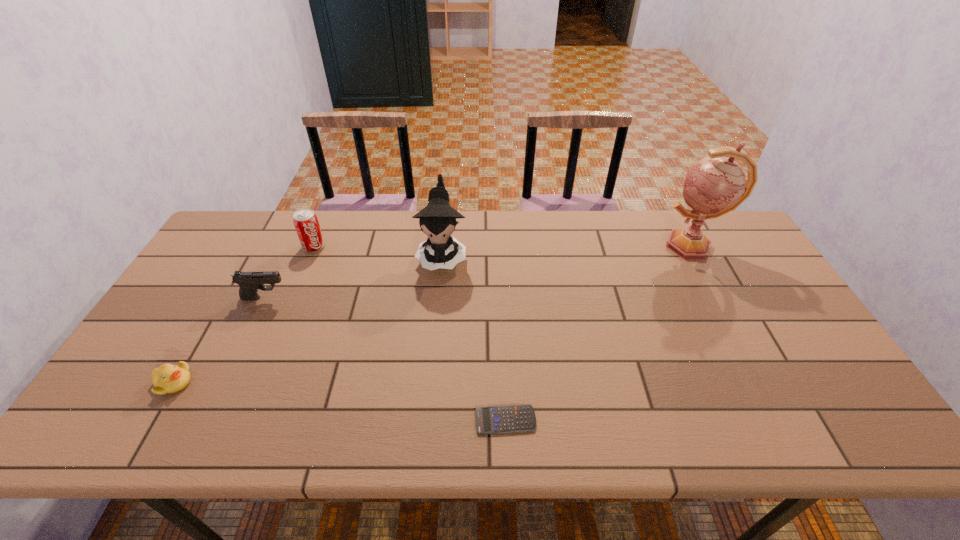
Find the location of a particular element. The image size is (960, 540). the nearest object is located at coordinates (502, 419).

Where is `blank space located 0.120m on the front-facing side of the globe`? Image resolution: width=960 pixels, height=540 pixels. blank space located 0.120m on the front-facing side of the globe is located at coordinates (622, 246).

At what (x,y) coordinates should I click in order to perform the action: click on vacant space situated 0.390m on the front-facing side of the globe. Please return your answer as a coordinate pair (x, y). The image size is (960, 540). Looking at the image, I should click on (540, 246).

This screenshot has width=960, height=540. I want to click on free space located 0.310m on the front-facing side of the globe, so tap(564, 246).

Locate an element on the screen. vacant space located 0.400m at the face of the third object from right to left is located at coordinates (429, 397).

You are a GUI agent. You are given a task and a screenshot of the screen. Output one action in this format:
    pyautogui.click(x=<x>, y=<y>)
    Task: Click on the free region located on the left of the third tallest object
    
    Given the screenshot: What is the action you would take?
    pyautogui.click(x=232, y=247)

Where is `vacant space positioned at the barrel of the pistol`? This screenshot has height=540, width=960. vacant space positioned at the barrel of the pistol is located at coordinates (354, 298).

I want to click on free location located 0.120m at the face of the second nearest object, so click(x=241, y=382).

In order to click on free spot located on the back of the shortest object in this screenshot , I will do `click(502, 353)`.

I want to click on globe positioned at the far edge, so pos(715,185).